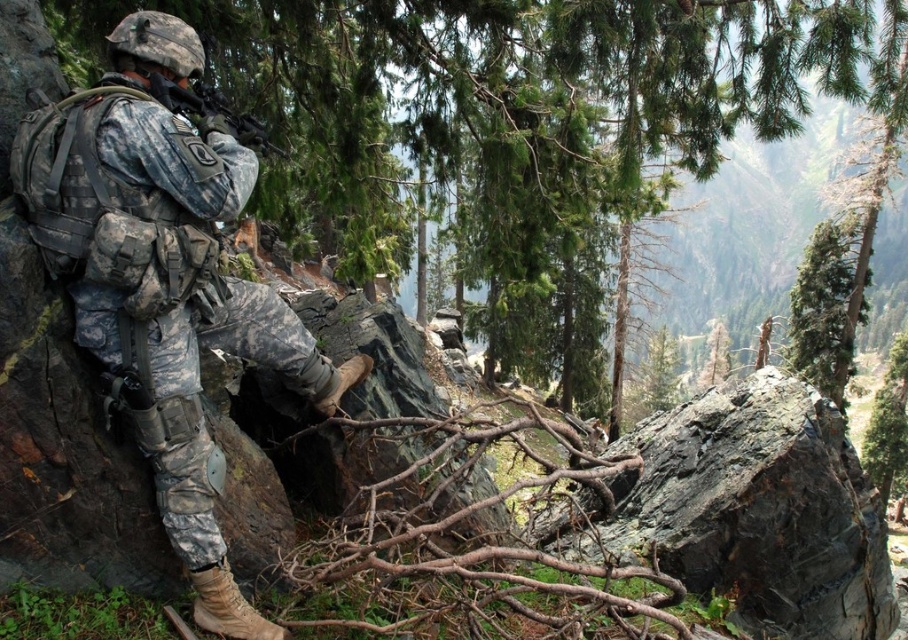
Does camouflage fabric uniform at left have a lesser width compared to green rough bark tree at upper right?

Yes, camouflage fabric uniform at left is thinner than green rough bark tree at upper right.

Can you confirm if camouflage fabric uniform at left is shorter than green rough bark tree at upper right?

Yes, camouflage fabric uniform at left is shorter than green rough bark tree at upper right.

Where is `camouflage fabric uniform at left`? Image resolution: width=908 pixels, height=640 pixels. camouflage fabric uniform at left is located at coordinates (163, 275).

At what (x,y) coordinates should I click in order to perform the action: click on camouflage fabric uniform at left. Please return your answer as a coordinate pair (x, y). The image size is (908, 640). Looking at the image, I should click on (163, 275).

Is camouflage fabric uniform at left above matte black rifle at center?

Incorrect, camouflage fabric uniform at left is not positioned above matte black rifle at center.

Is camouflage fabric uniform at left positioned behind matte black rifle at center?

No, it is in front of matte black rifle at center.

I want to click on camouflage fabric uniform at left, so click(x=163, y=275).

Who is shorter, green rough bark tree at upper right or matte black rifle at center?

With less height is matte black rifle at center.

Who is more forward, (x=834, y=257) or (x=238, y=124)?

Point (x=238, y=124)

This screenshot has width=908, height=640. Identify the location of green rough bark tree at upper right. (828, 305).